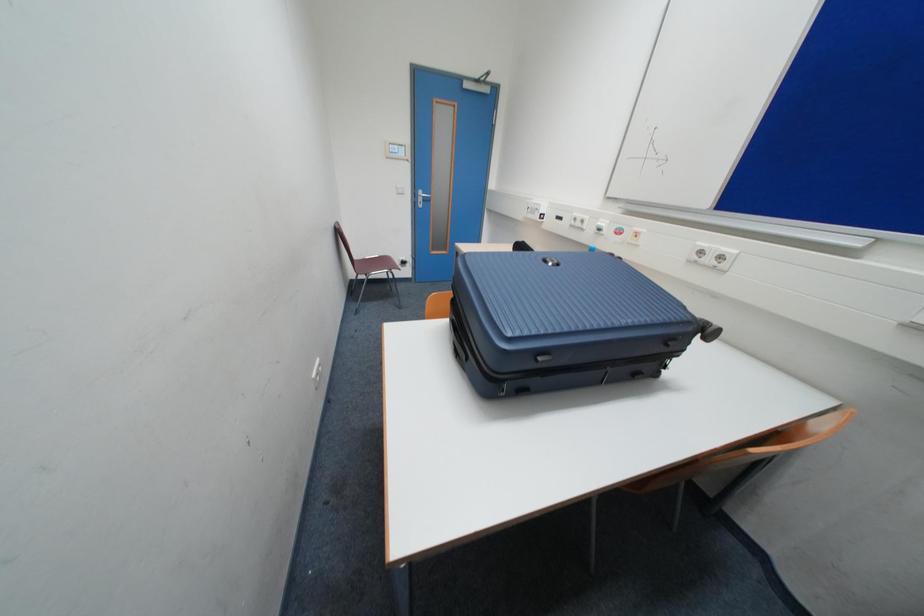
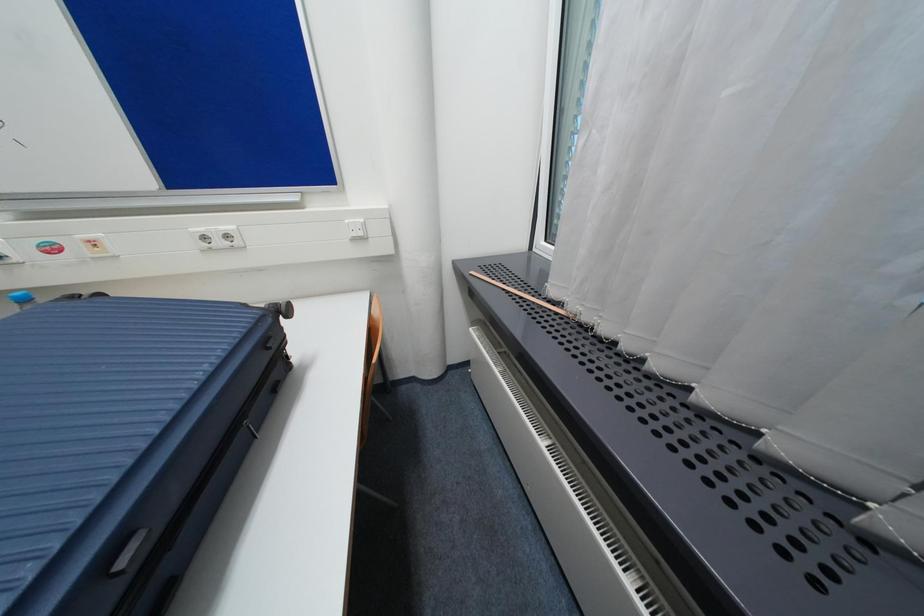
The first image is from the beginning of the video and the second image is from the end. How did the camera likely rotate when shooting the video?

The camera's rotation is toward right-down.